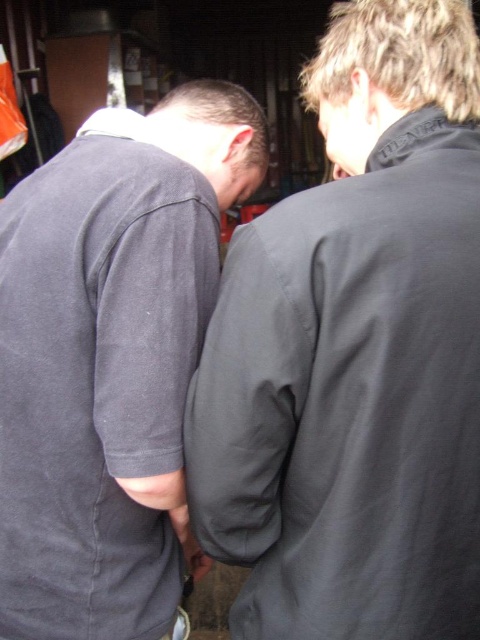
Question: Is dark gray fabric at center above dark gray cotton shirt at center?

Choices:
 (A) yes
 (B) no

Answer: (A)

Question: Considering the relative positions of dark gray fabric at center and dark gray cotton shirt at center in the image provided, where is dark gray fabric at center located with respect to dark gray cotton shirt at center?

Choices:
 (A) below
 (B) above

Answer: (B)

Question: Among these points, which one is nearest to the camera?

Choices:
 (A) (72, 388)
 (B) (387, 28)

Answer: (A)

Question: Which of the following is the closest to the observer?

Choices:
 (A) dark gray cotton shirt at center
 (B) dark gray fabric at center

Answer: (B)

Question: Can you confirm if dark gray fabric at center is positioned above dark gray cotton shirt at center?

Choices:
 (A) no
 (B) yes

Answer: (B)